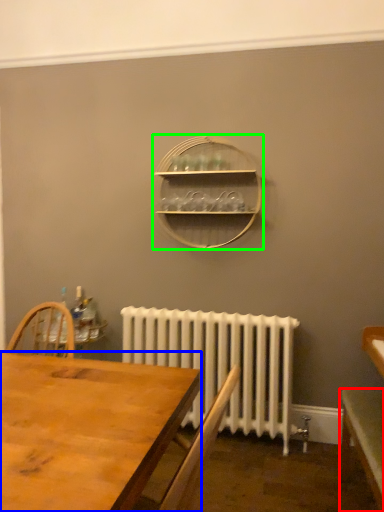
Question: Which object is positioned farthest from table (highlighted by a red box)? Select from desk (highlighted by a blue box) and shelf (highlighted by a green box).

Choices:
 (A) desk
 (B) shelf

Answer: (B)